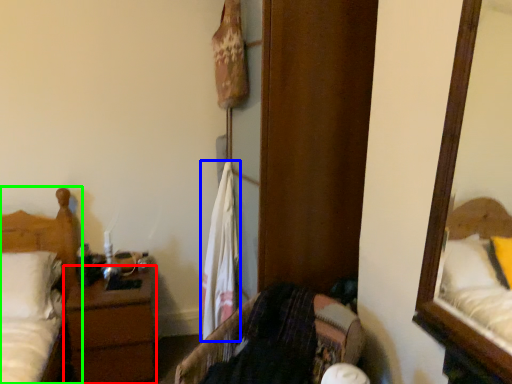
Question: Estimate the real-world distances between objects in this image. Which object is closer to nightstand (highlighted by a red box), laundry (highlighted by a blue box) or bed (highlighted by a green box)?

Choices:
 (A) laundry
 (B) bed

Answer: (B)